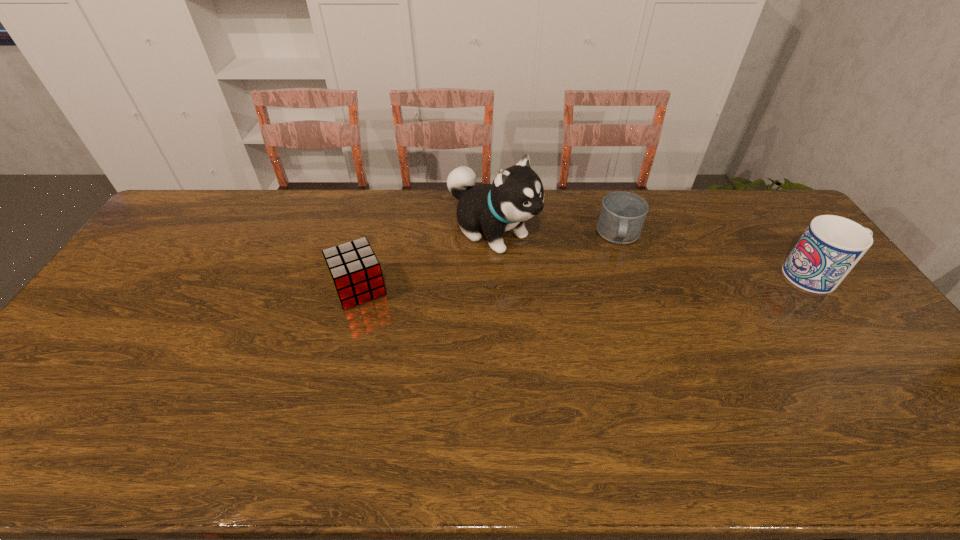
Identify the location of free space in the image that satisfies the following two spatial constraints: 1. on the front side of the shorter mug; 2. on the left side of the rightmost object. This screenshot has height=540, width=960. (633, 276).